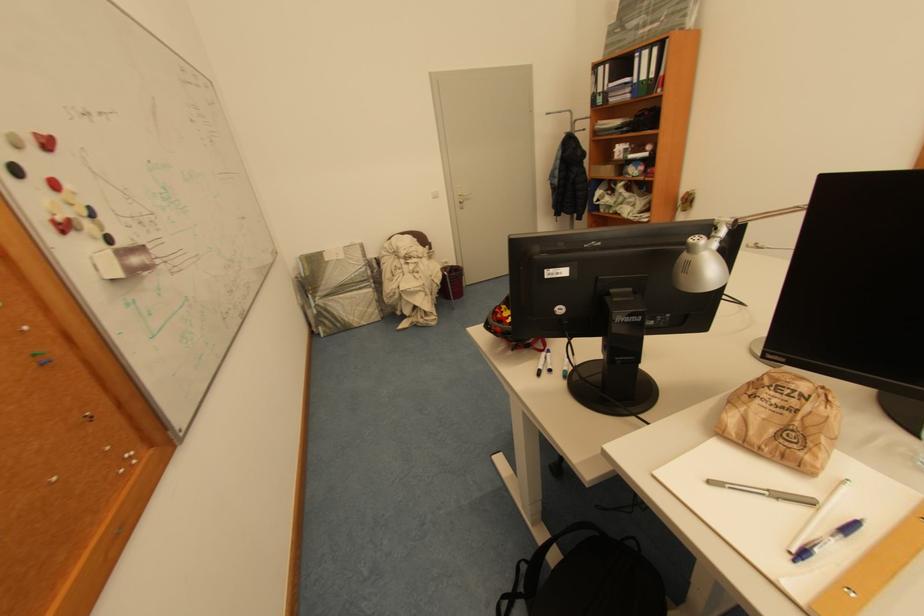
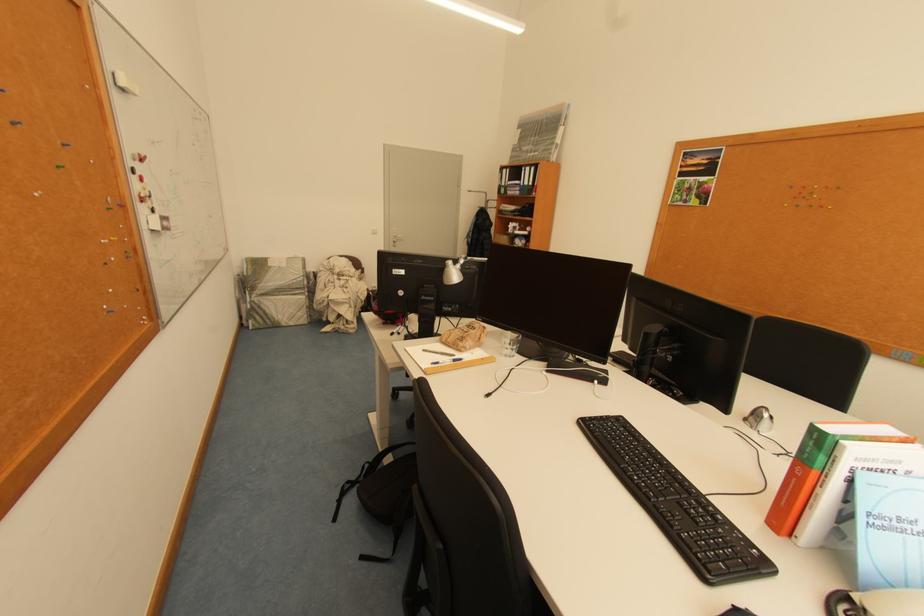
Question: The first image is from the beginning of the video and the second image is from the end. How did the camera likely rotate when shooting the video?

Choices:
 (A) Left
 (B) Right
 (C) Up
 (D) Down

Answer: (B)